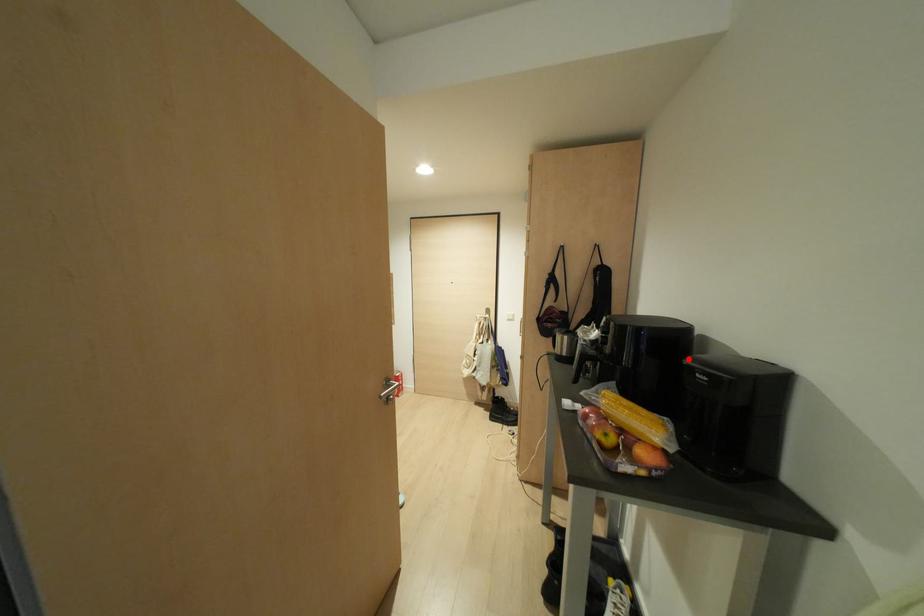
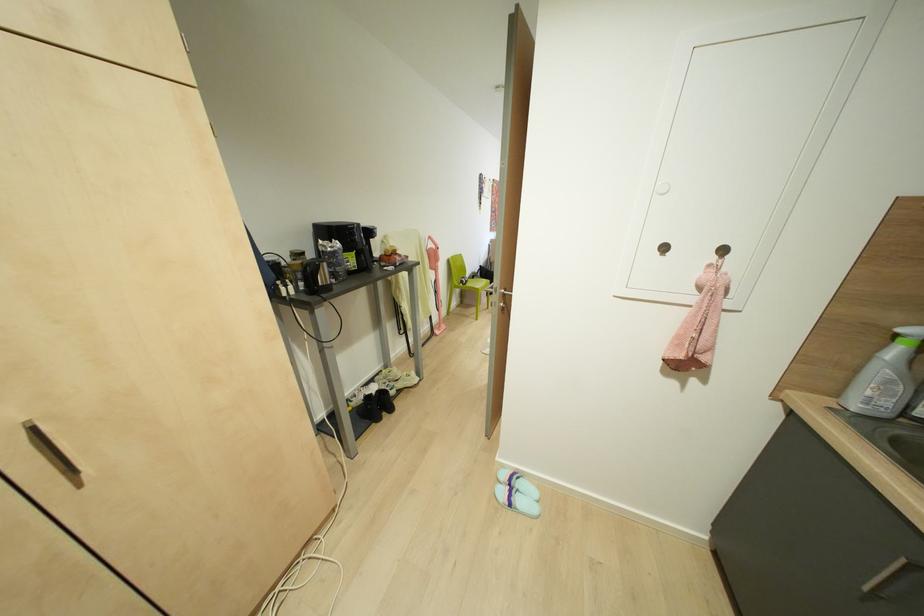
Question: I am providing you with two images of the same scene from different viewpoints. A red point is marked on the first image. Can you still see the location of the red point in image 2?

Choices:
 (A) Yes
 (B) No

Answer: (B)